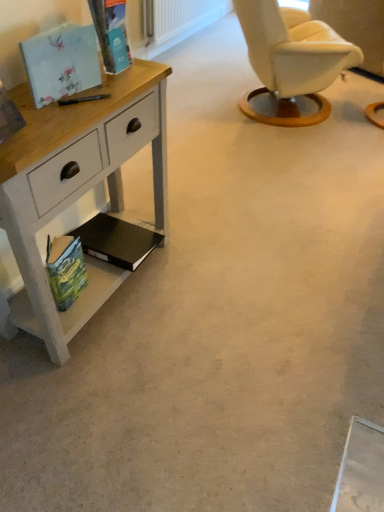
In order to face black matte book at lower left, arranged as the third magazine when viewed from the top, should I rotate leftwards or rightwards?

You should rotate left by 9.989 degrees.

Find the location of a particular element. Image resolution: width=384 pixels, height=512 pixels. matte cardboard magazine at upper left, which is the 1th magazine from top to bottom is located at coordinates (111, 33).

What are the coordinates of `black matte book at lower left, the 2th magazine from the bottom` in the screenshot? It's located at (116, 241).

From the picture: How many degrees apart are the facing directions of green matte book at lower left, the first magazine from the bottom, and black matte book at lower left, the 2th magazine from the bottom?

The facing directions of green matte book at lower left, the first magazine from the bottom, and black matte book at lower left, the 2th magazine from the bottom, are 5.89 degrees apart.

Would you consider green matte book at lower left, acting as the 4th magazine starting from the top, to be distant from black matte book at lower left, the 2th magazine from the bottom?

No, there isn't a large distance between green matte book at lower left, acting as the 4th magazine starting from the top, and black matte book at lower left, the 2th magazine from the bottom.

Considering the relative positions of green matte book at lower left, the first magazine from the bottom, and black matte book at lower left, the 2th magazine from the bottom, in the image provided, is green matte book at lower left, the first magazine from the bottom, to the left or to the right of black matte book at lower left, the 2th magazine from the bottom,?

green matte book at lower left, the first magazine from the bottom, is to the left of black matte book at lower left, the 2th magazine from the bottom.

Does point (49, 271) appear closer or farther from the camera than point (77, 228)?

Point (49, 271) is positioned closer to the camera compared to point (77, 228).

Can you confirm if white painted wood desk at left is shorter than green matte book at lower left, acting as the 4th magazine starting from the top?

In fact, white painted wood desk at left may be taller than green matte book at lower left, acting as the 4th magazine starting from the top.

Does point (163, 100) lie behind point (55, 248)?

That is True.

Image resolution: width=384 pixels, height=512 pixels. What are the coordinates of `magazine that is the 1st one below the white painted wood desk at left (from a real-world perspective)` in the screenshot? It's located at (65, 269).

Does white painted wood desk at left come in front of green matte book at lower left, acting as the 4th magazine starting from the top?

Yes, white painted wood desk at left is closer to the viewer.

From the white painted wood desk at left, count 1st magazines backward and point to it. Please provide its 2D coordinates.

[(61, 62)]

From the image's perspective, is white painted wood desk at left above or below matte floral-patterned book at upper left, the 2th magazine from the top?

white painted wood desk at left is below matte floral-patterned book at upper left, the 2th magazine from the top.

Is matte floral-patterned book at upper left, which appears as the 3th magazine when ordered from the bottom, at the back of white painted wood desk at left?

No, white painted wood desk at left is not facing away from matte floral-patterned book at upper left, which appears as the 3th magazine when ordered from the bottom.

Is white painted wood desk at left looking in the opposite direction of matte cardboard magazine at upper left, which is the 1th magazine from top to bottom?

white painted wood desk at left is not turned away from matte cardboard magazine at upper left, which is the 1th magazine from top to bottom.

From the image's perspective, is white painted wood desk at left on top of matte cardboard magazine at upper left, which is the fourth magazine in bottom-to-top order?

No.

Does point (76, 143) appear closer or farther from the camera than point (117, 45)?

Point (76, 143).

Considering the relative sizes of white painted wood desk at left and matte cardboard magazine at upper left, which is the fourth magazine in bottom-to-top order, in the image provided, is white painted wood desk at left shorter than matte cardboard magazine at upper left, which is the fourth magazine in bottom-to-top order,?

No, white painted wood desk at left is not shorter than matte cardboard magazine at upper left, which is the fourth magazine in bottom-to-top order.

Locate an element on the screen. magazine that is the 1st one when counting downward from the white painted wood desk at left (from the image's perspective) is located at coordinates (116, 241).

From a real-world perspective, who is located lower, white painted wood desk at left or black matte book at lower left, arranged as the third magazine when viewed from the top?

black matte book at lower left, arranged as the third magazine when viewed from the top, from a real-world perspective.

Can you confirm if white painted wood desk at left is smaller than black matte book at lower left, the 2th magazine from the bottom?

Actually, white painted wood desk at left might be larger than black matte book at lower left, the 2th magazine from the bottom.

Can you confirm if white painted wood desk at left is positioned to the right of black matte book at lower left, arranged as the third magazine when viewed from the top?

No.

Can you tell me how much matte cardboard magazine at upper left, which is the fourth magazine in bottom-to-top order, and white painted wood desk at left differ in facing direction?

They differ by 0.352 degrees in their facing directions.

Considering the relative sizes of matte cardboard magazine at upper left, which is the fourth magazine in bottom-to-top order, and white painted wood desk at left in the image provided, is matte cardboard magazine at upper left, which is the fourth magazine in bottom-to-top order, thinner than white painted wood desk at left?

Yes, matte cardboard magazine at upper left, which is the fourth magazine in bottom-to-top order, is thinner than white painted wood desk at left.

Does matte cardboard magazine at upper left, which is the fourth magazine in bottom-to-top order, turn towards white painted wood desk at left?

No, matte cardboard magazine at upper left, which is the fourth magazine in bottom-to-top order, is not oriented towards white painted wood desk at left.

Is matte cardboard magazine at upper left, which is the fourth magazine in bottom-to-top order, beside white painted wood desk at left?

No, matte cardboard magazine at upper left, which is the fourth magazine in bottom-to-top order, is not making contact with white painted wood desk at left.

Looking at this image, from a real-world perspective, is matte floral-patterned book at upper left, the 2th magazine from the top, located higher than green matte book at lower left, acting as the 4th magazine starting from the top?

Yes, from a real-world perspective, matte floral-patterned book at upper left, the 2th magazine from the top, is over green matte book at lower left, acting as the 4th magazine starting from the top

Is matte floral-patterned book at upper left, the 2th magazine from the top, positioned with its back to green matte book at lower left, the first magazine from the bottom?

No.

In terms of height, does matte floral-patterned book at upper left, which appears as the 3th magazine when ordered from the bottom, look taller or shorter compared to green matte book at lower left, the first magazine from the bottom?

Considering their sizes, matte floral-patterned book at upper left, which appears as the 3th magazine when ordered from the bottom, has less height than green matte book at lower left, the first magazine from the bottom.

From the image's perspective, is matte floral-patterned book at upper left, the 2th magazine from the top, located above or below green matte book at lower left, the first magazine from the bottom?

matte floral-patterned book at upper left, the 2th magazine from the top, is situated higher than green matte book at lower left, the first magazine from the bottom, in the image.

From the black matte book at lower left, arranged as the third magazine when viewed from the top, count 1st magazines forward and point to it. Please provide its 2D coordinates.

[(65, 269)]

The height and width of the screenshot is (512, 384). Identify the location of desk that appears above the green matte book at lower left, the first magazine from the bottom (from a real-world perspective). (77, 187).

Based on their spatial positions, is black matte book at lower left, arranged as the third magazine when viewed from the top, or matte floral-patterned book at upper left, the 2th magazine from the top, further from white painted wood desk at left?

black matte book at lower left, arranged as the third magazine when viewed from the top, lies further to white painted wood desk at left than the other object.

Looking at the image, which one is located closer to green matte book at lower left, acting as the 4th magazine starting from the top, black matte book at lower left, the 2th magazine from the bottom, or matte cardboard magazine at upper left, which is the 1th magazine from top to bottom?

black matte book at lower left, the 2th magazine from the bottom, is closer to green matte book at lower left, acting as the 4th magazine starting from the top.

Considering their positions, is white painted wood desk at left positioned further to matte floral-patterned book at upper left, the 2th magazine from the top, than matte cardboard magazine at upper left, which is the 1th magazine from top to bottom?

white painted wood desk at left is positioned further to the anchor matte floral-patterned book at upper left, the 2th magazine from the top.

Estimate the real-world distances between objects in this image. Which object is further from matte floral-patterned book at upper left, which appears as the 3th magazine when ordered from the bottom, green matte book at lower left, the first magazine from the bottom, or matte cardboard magazine at upper left, which is the 1th magazine from top to bottom?

Based on the image, green matte book at lower left, the first magazine from the bottom, appears to be further to matte floral-patterned book at upper left, which appears as the 3th magazine when ordered from the bottom.

Based on the photo, estimate the real-world distances between objects in this image. Which object is closer to matte floral-patterned book at upper left, the 2th magazine from the top, black matte book at lower left, arranged as the third magazine when viewed from the top, or matte cardboard magazine at upper left, which is the 1th magazine from top to bottom?

The object closer to matte floral-patterned book at upper left, the 2th magazine from the top, is matte cardboard magazine at upper left, which is the 1th magazine from top to bottom.

Looking at the image, which one is located further to white painted wood desk at left, green matte book at lower left, the first magazine from the bottom, or matte cardboard magazine at upper left, which is the fourth magazine in bottom-to-top order?

Among the two, matte cardboard magazine at upper left, which is the fourth magazine in bottom-to-top order, is located further to white painted wood desk at left.

Based on their spatial positions, is green matte book at lower left, the first magazine from the bottom, or black matte book at lower left, arranged as the third magazine when viewed from the top, further from matte floral-patterned book at upper left, the 2th magazine from the top?

Based on the image, black matte book at lower left, arranged as the third magazine when viewed from the top, appears to be further to matte floral-patterned book at upper left, the 2th magazine from the top.

Considering their positions, is black matte book at lower left, the 2th magazine from the bottom, positioned further to white painted wood desk at left than green matte book at lower left, the first magazine from the bottom?

Among the two, black matte book at lower left, the 2th magazine from the bottom, is located further to white painted wood desk at left.

The image size is (384, 512). I want to click on magazine between matte cardboard magazine at upper left, which is the fourth magazine in bottom-to-top order, and white painted wood desk at left in the up-down direction, so click(61, 62).

Identify the location of desk that lies between matte cardboard magazine at upper left, which is the fourth magazine in bottom-to-top order, and green matte book at lower left, the first magazine from the bottom, from top to bottom. The height and width of the screenshot is (512, 384). (77, 187).

Identify the location of magazine between matte cardboard magazine at upper left, which is the 1th magazine from top to bottom, and black matte book at lower left, arranged as the third magazine when viewed from the top, in the vertical direction. The image size is (384, 512). (61, 62).

The width and height of the screenshot is (384, 512). In order to click on desk between matte floral-patterned book at upper left, which appears as the 3th magazine when ordered from the bottom, and green matte book at lower left, the first magazine from the bottom, vertically in this screenshot , I will do (x=77, y=187).